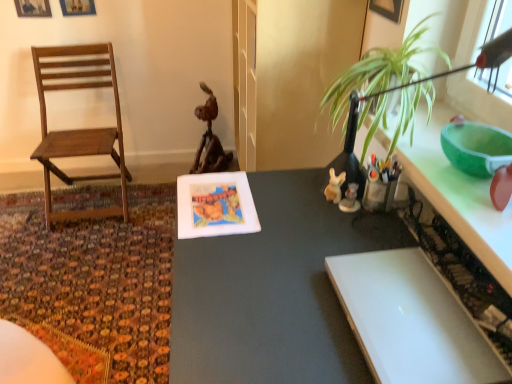
Question: Is rustic wood statue at center far away from green glossy counter top at upper right?

Choices:
 (A) no
 (B) yes

Answer: (B)

Question: Considering the relative positions of rustic wood statue at center and green glossy counter top at upper right in the image provided, is rustic wood statue at center behind green glossy counter top at upper right?

Choices:
 (A) yes
 (B) no

Answer: (A)

Question: Can you confirm if rustic wood statue at center is thinner than green glossy counter top at upper right?

Choices:
 (A) no
 (B) yes

Answer: (A)

Question: From a real-world perspective, is rustic wood statue at center located higher than green glossy counter top at upper right?

Choices:
 (A) yes
 (B) no

Answer: (B)

Question: Is rustic wood statue at center taller than green glossy counter top at upper right?

Choices:
 (A) yes
 (B) no

Answer: (A)

Question: Is white glossy figurine at center-right, which is the second toy from left to right, taller or shorter than rustic wood statue at center?

Choices:
 (A) tall
 (B) short

Answer: (B)

Question: In terms of size, does white glossy figurine at center-right, the 1th toy from the right, appear bigger or smaller than rustic wood statue at center?

Choices:
 (A) big
 (B) small

Answer: (B)

Question: From a real-world perspective, is white glossy figurine at center-right, the 1th toy from the right, positioned above or below rustic wood statue at center?

Choices:
 (A) below
 (B) above

Answer: (B)

Question: In the image, is white glossy figurine at center-right, the 1th toy from the right, positioned in front of or behind rustic wood statue at center?

Choices:
 (A) behind
 (B) front

Answer: (B)

Question: Is matte gray table at center spatially inside wooden chair at left, or outside of it?

Choices:
 (A) inside
 (B) outside

Answer: (B)

Question: Does point (210, 349) appear closer or farther from the camera than point (62, 147)?

Choices:
 (A) farther
 (B) closer

Answer: (B)

Question: From a real-world perspective, is matte gray table at center above or below wooden chair at left?

Choices:
 (A) below
 (B) above

Answer: (A)

Question: Considering the positions of matte gray table at center and wooden chair at left in the image, is matte gray table at center wider or thinner than wooden chair at left?

Choices:
 (A) wide
 (B) thin

Answer: (A)

Question: In the image, is matte gray table at center positioned in front of or behind white glossy figurine at center-right, which is the second toy from left to right?

Choices:
 (A) front
 (B) behind

Answer: (A)

Question: Is matte gray table at center to the left or to the right of white glossy figurine at center-right, which is the second toy from left to right, in the image?

Choices:
 (A) right
 (B) left

Answer: (B)